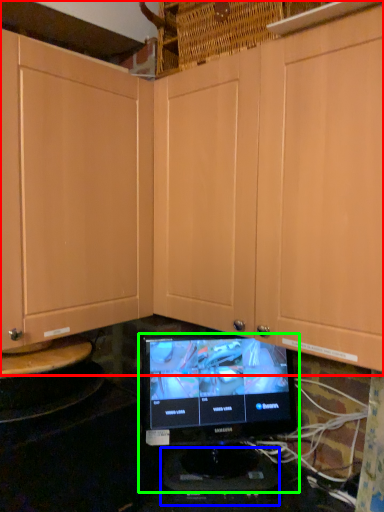
Question: Which object is the farthest from cabinetry (highlighted by a red box)? Choose among these: appliance (highlighted by a blue box) or computer monitor (highlighted by a green box).

Choices:
 (A) appliance
 (B) computer monitor

Answer: (A)